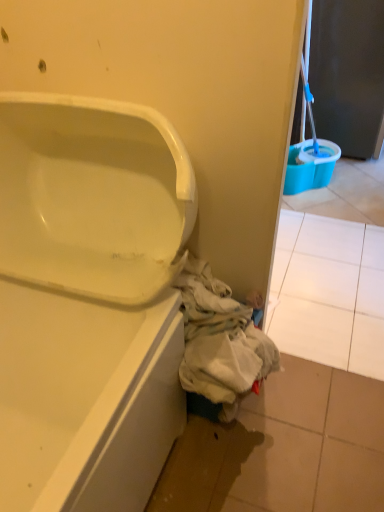
You are a GUI agent. You are given a task and a screenshot of the screen. Output one action in this format:
    pyautogui.click(x=<x>, y=<y>)
    Task: Click on the white glossy bathtub at lower left
    
    Given the screenshot: What is the action you would take?
    pyautogui.click(x=89, y=302)

Measure the distance between point (273, 295) and camera.

The depth of point (273, 295) is 1.97 meters.

In order to face white fabric at lower right, should I rotate leftwards or rightwards?

You should look right and rotate roughly 5.247 degrees.

The height and width of the screenshot is (512, 384). I want to click on white fabric at lower right, so click(x=220, y=341).

Locate an element on the screen. This screenshot has width=384, height=512. white glossy bathtub at lower left is located at coordinates (89, 302).

Is white fabric at lower right taller than white tile at lower right?

Yes.

From a real-world perspective, is white fabric at lower right positioned under white tile at lower right based on gravity?

Incorrect, from a real-world perspective, white fabric at lower right is higher than white tile at lower right.

Is white fabric at lower right oriented away from white tile at lower right?

Yes, white tile at lower right is at the back of white fabric at lower right.

Is white fabric at lower right with white tile at lower right?

No, white fabric at lower right is not beside white tile at lower right.

Does white tile at lower right have a smaller size compared to white glossy bathtub at lower left?

Indeed, white tile at lower right has a smaller size compared to white glossy bathtub at lower left.

Is point (354, 344) behind point (175, 293)?

Yes.

Could you tell me if white tile at lower right is facing white glossy bathtub at lower left?

No.

Can we say white tile at lower right lies outside white glossy bathtub at lower left?

That's correct, white tile at lower right is outside of white glossy bathtub at lower left.

At what (x,y) coordinates should I click in order to perform the action: click on garbage behind the white glossy bathtub at lower left. Please return your answer as a coordinate pair (x, y). Looking at the image, I should click on (220, 341).

How different are the orientations of white glossy bathtub at lower left and white fabric at lower right in degrees?

90 degrees separate the facing orientations of white glossy bathtub at lower left and white fabric at lower right.

Considering the relative sizes of white glossy bathtub at lower left and white fabric at lower right in the image provided, is white glossy bathtub at lower left smaller than white fabric at lower right?

A: No, white glossy bathtub at lower left is not smaller than white fabric at lower right.

In the scene shown: From the image's perspective, is white glossy bathtub at lower left over matte black screen door at upper right?

No, from the image's perspective, white glossy bathtub at lower left is not over matte black screen door at upper right.

Is white glossy bathtub at lower left to the right of matte black screen door at upper right from the viewer's perspective?

No.

Is point (111, 151) closer or farther from the camera than point (379, 67)?

Point (111, 151) is positioned closer to the camera compared to point (379, 67).

From the image's perspective, is matte black screen door at upper right above or below white fabric at lower right?

Clearly, from the image's perspective, matte black screen door at upper right is above white fabric at lower right.

Considering the sizes of matte black screen door at upper right and white fabric at lower right in the image, is matte black screen door at upper right wider or thinner than white fabric at lower right?

Considering their sizes, matte black screen door at upper right looks broader than white fabric at lower right.

Can you confirm if matte black screen door at upper right is taller than white fabric at lower right?

Correct, matte black screen door at upper right is much taller as white fabric at lower right.

Would you say matte black screen door at upper right contains white fabric at lower right?

That's incorrect, white fabric at lower right is not inside matte black screen door at upper right.

Is the surface of white tile at lower right in direct contact with matte black screen door at upper right?

There is a gap between white tile at lower right and matte black screen door at upper right.

Is point (366, 342) closer or farther from the camera than point (330, 41)?

Point (366, 342) appears to be closer to the viewer than point (330, 41).

Is white tile at lower right taller or shorter than matte black screen door at upper right?

In the image, white tile at lower right appears to be shorter than matte black screen door at upper right.

Who is more distant, white tile at lower right or matte black screen door at upper right?

matte black screen door at upper right is behind.

Is matte black screen door at upper right positioned beyond the bounds of white tile at lower right?

matte black screen door at upper right is positioned outside white tile at lower right.

Is matte black screen door at upper right at the left side of white tile at lower right?

In fact, matte black screen door at upper right is to the right of white tile at lower right.

What's the angular difference between matte black screen door at upper right and white tile at lower right's facing directions?

There is a 88.5-degree angle between the facing directions of matte black screen door at upper right and white tile at lower right.

Can you confirm if matte black screen door at upper right is bigger than white tile at lower right?

Yes, matte black screen door at upper right is bigger than white tile at lower right.

You are a GUI agent. You are given a task and a screenshot of the screen. Output one action in this format:
    pyautogui.click(x=<x>, y=<y>)
    Task: Click on the tile lying on the right of white fabric at lower right
    This screenshot has height=512, width=384.
    Given the screenshot: What is the action you would take?
    pyautogui.click(x=329, y=292)

Find the location of a particular element. tile directly beneath the white glossy bathtub at lower left (from a real-world perspective) is located at coordinates (329, 292).

Consider the image. Considering their positions, is matte black screen door at upper right positioned closer to white glossy bathtub at lower left than white fabric at lower right?

white fabric at lower right.

When comparing their distances from white glossy bathtub at lower left, does white tile at lower right or white fabric at lower right seem further?

white tile at lower right lies further to white glossy bathtub at lower left than the other object.

When comparing their distances from white fabric at lower right, does white glossy bathtub at lower left or white tile at lower right seem further?

The object further to white fabric at lower right is white tile at lower right.

Considering their positions, is white tile at lower right positioned closer to matte black screen door at upper right than white fabric at lower right?

Among the two, white tile at lower right is located nearer to matte black screen door at upper right.

Estimate the real-world distances between objects in this image. Which object is further from white tile at lower right, white glossy bathtub at lower left or white fabric at lower right?

white glossy bathtub at lower left is positioned further to the anchor white tile at lower right.

Looking at the image, which one is located further to white glossy bathtub at lower left, white fabric at lower right or white tile at lower right?

white tile at lower right lies further to white glossy bathtub at lower left than the other object.

When comparing their distances from white fabric at lower right, does white glossy bathtub at lower left or matte black screen door at upper right seem closer?

Among the two, white glossy bathtub at lower left is located nearer to white fabric at lower right.

Estimate the real-world distances between objects in this image. Which object is closer to matte black screen door at upper right, white fabric at lower right or white tile at lower right?

white tile at lower right is positioned closer to the anchor matte black screen door at upper right.

Image resolution: width=384 pixels, height=512 pixels. What are the coordinates of `garbage between white glossy bathtub at lower left and white tile at lower right from left to right` in the screenshot? It's located at (220, 341).

Identify the location of tile between matte black screen door at upper right and white glossy bathtub at lower left from top to bottom. The height and width of the screenshot is (512, 384). tap(329, 292).

Locate an element on the screen. garbage between matte black screen door at upper right and white glossy bathtub at lower left in the up-down direction is located at coordinates (220, 341).

The image size is (384, 512). In order to click on tile between matte black screen door at upper right and white fabric at lower right in the up-down direction in this screenshot , I will do `click(329, 292)`.